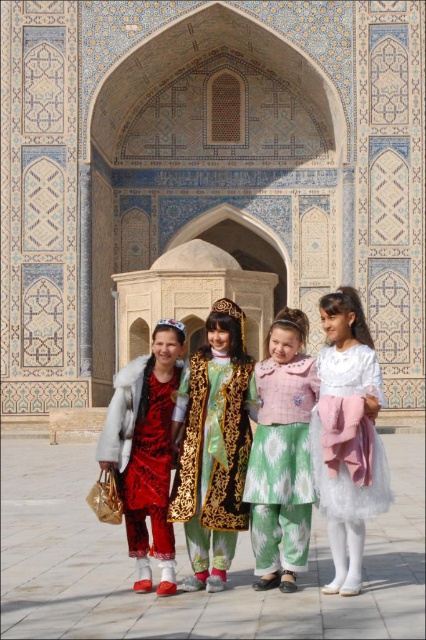
Question: Which point is closer to the camera taking this photo?

Choices:
 (A) (371, 436)
 (B) (196, 352)

Answer: (A)

Question: Considering the real-world distances, which object is farthest from the red satin dress at left?

Choices:
 (A) gold embroidered dress at center
 (B) pastel pink fabric dress at center

Answer: (B)

Question: Which object is the closest to the pastel pink fabric dress at center?

Choices:
 (A) red satin dress at left
 (B) white tulle dress at center

Answer: (B)

Question: Is pastel pink fabric dress at center smaller than red satin dress at left?

Choices:
 (A) yes
 (B) no

Answer: (A)

Question: Is the position of gold embroidered dress at center more distant than that of red satin dress at left?

Choices:
 (A) no
 (B) yes

Answer: (A)

Question: Can you confirm if gold embroidered dress at center is thinner than pastel pink fabric dress at center?

Choices:
 (A) yes
 (B) no

Answer: (B)